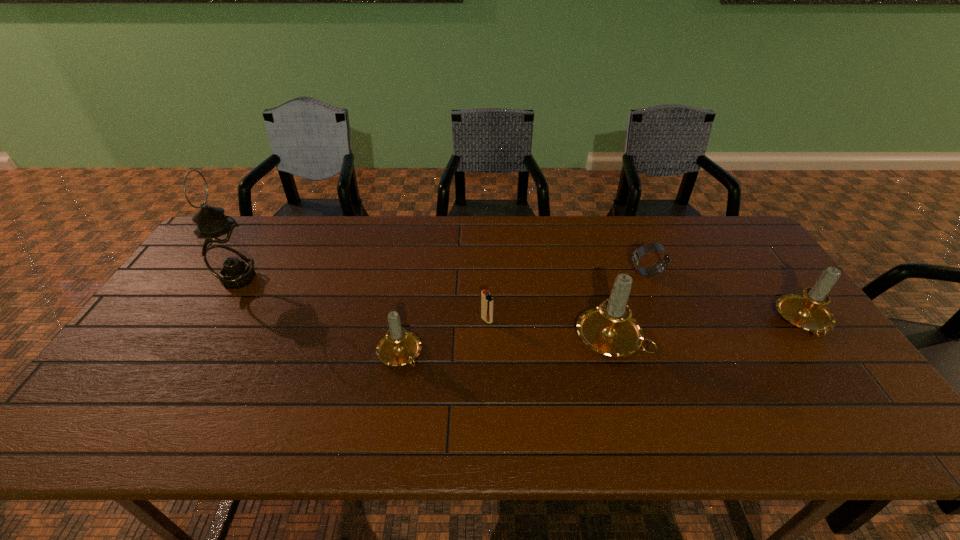
In the current image, all candles are evenly spaced. To maintain this equal spacing, where should an additional candle be placed on the left? Please point out a free spot. Please provide its 2D coordinates. Your answer should be formatted as a tuple, i.e. [(x, y)], where the tuple contains the x and y coordinates of a point satisfying the conditions above.

[(175, 372)]